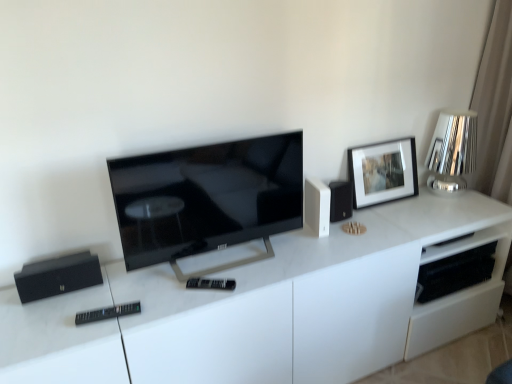
Where is `free space in front of shiny metallic lamp at upper right`? The width and height of the screenshot is (512, 384). free space in front of shiny metallic lamp at upper right is located at coordinates (448, 212).